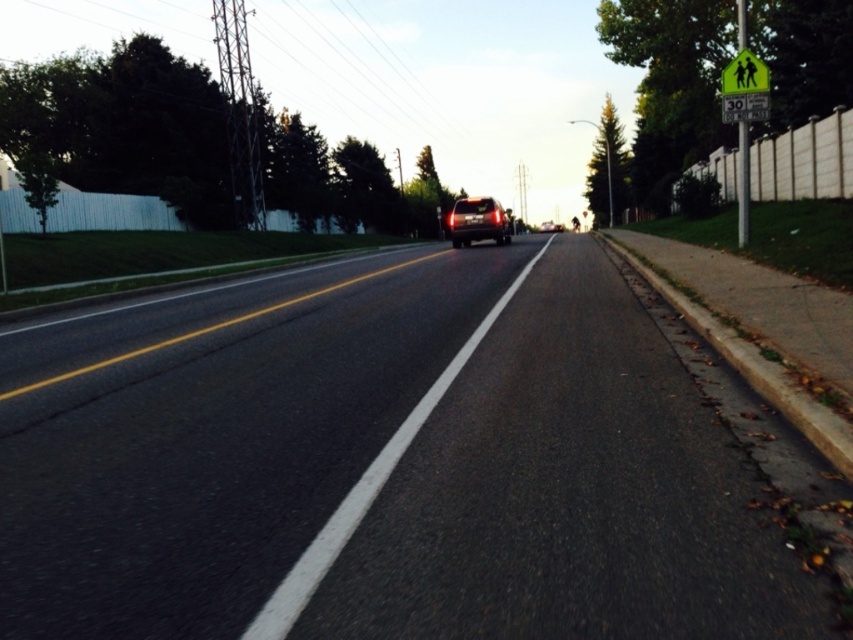
Question: Which is nearer to the satin black suv at center?

Choices:
 (A) black asphalt road at center
 (B) green reflective pedestrian crossing sign at upper right

Answer: (A)

Question: Is black asphalt road at center thinner than shiny silver suv at center?

Choices:
 (A) yes
 (B) no

Answer: (A)

Question: Is black asphalt road at center thinner than green reflective pedestrian crossing sign at upper right?

Choices:
 (A) no
 (B) yes

Answer: (A)

Question: Which point is farther from the camera taking this photo?

Choices:
 (A) (502, 314)
 (B) (544, 228)
 (C) (467, 209)
 (D) (752, 58)

Answer: (B)

Question: Which of the following is the farthest from the observer?

Choices:
 (A) (762, 61)
 (B) (496, 218)

Answer: (B)

Question: Does satin black suv at center have a greater width compared to green reflective pedestrian crossing sign at upper right?

Choices:
 (A) yes
 (B) no

Answer: (A)